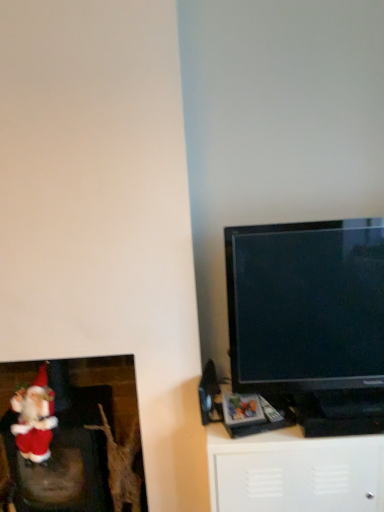
Question: Does point (49, 474) appear closer or farther from the camera than point (258, 480)?

Choices:
 (A) farther
 (B) closer

Answer: (A)

Question: Is red plush santa at lower left taller or shorter than white matte cabinet at lower right?

Choices:
 (A) short
 (B) tall

Answer: (B)

Question: Which object is positioned farthest from the black glossy tv at right?

Choices:
 (A) red plush santa at lower left
 (B) white matte cabinet at lower right
 (C) fuzzy fabric santa at lower left

Answer: (C)

Question: Which object is the farthest from the red plush santa at lower left?

Choices:
 (A) black glossy tv at right
 (B) white matte cabinet at lower right
 (C) fuzzy fabric santa at lower left

Answer: (A)